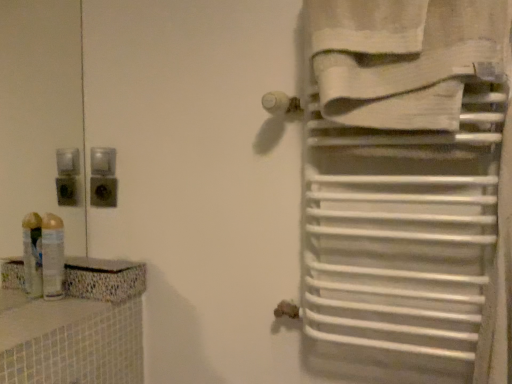
Question: Is white cotton towel at upper right oriented towards translucent plastic spray can at left?

Choices:
 (A) yes
 (B) no

Answer: (B)

Question: Can you confirm if white cotton towel at upper right is taller than translucent plastic spray can at left?

Choices:
 (A) no
 (B) yes

Answer: (B)

Question: Can you confirm if white cotton towel at upper right is smaller than translucent plastic spray can at left?

Choices:
 (A) yes
 (B) no

Answer: (B)

Question: Does white cotton towel at upper right have a larger size compared to translucent plastic spray can at left?

Choices:
 (A) no
 (B) yes

Answer: (B)

Question: From a real-world perspective, is white cotton towel at upper right physically above translucent plastic spray can at left?

Choices:
 (A) yes
 (B) no

Answer: (A)

Question: Is translucent plastic spray can at left to the left or to the right of black plastic outlet at upper left in the image?

Choices:
 (A) left
 (B) right

Answer: (A)

Question: Is translucent plastic spray can at left wider or thinner than black plastic outlet at upper left?

Choices:
 (A) thin
 (B) wide

Answer: (B)

Question: Considering the positions of translucent plastic spray can at left and black plastic outlet at upper left in the image, is translucent plastic spray can at left bigger or smaller than black plastic outlet at upper left?

Choices:
 (A) big
 (B) small

Answer: (A)

Question: Is translucent plastic spray can at left in front of or behind black plastic outlet at upper left in the image?

Choices:
 (A) behind
 (B) front

Answer: (B)

Question: Is white cotton towel at upper right situated inside black plastic outlet at upper left or outside?

Choices:
 (A) inside
 (B) outside

Answer: (B)

Question: In the image, is white cotton towel at upper right positioned in front of or behind black plastic outlet at upper left?

Choices:
 (A) behind
 (B) front

Answer: (B)

Question: Considering the positions of white cotton towel at upper right and black plastic outlet at upper left in the image, is white cotton towel at upper right taller or shorter than black plastic outlet at upper left?

Choices:
 (A) short
 (B) tall

Answer: (B)

Question: From a real-world perspective, is white cotton towel at upper right above or below black plastic outlet at upper left?

Choices:
 (A) above
 (B) below

Answer: (A)

Question: Considering the positions of translucent plastic spray can at left and white cotton towel at upper right in the image, is translucent plastic spray can at left bigger or smaller than white cotton towel at upper right?

Choices:
 (A) big
 (B) small

Answer: (B)

Question: Would you say translucent plastic spray can at left is to the left or to the right of white cotton towel at upper right in the picture?

Choices:
 (A) right
 (B) left

Answer: (B)